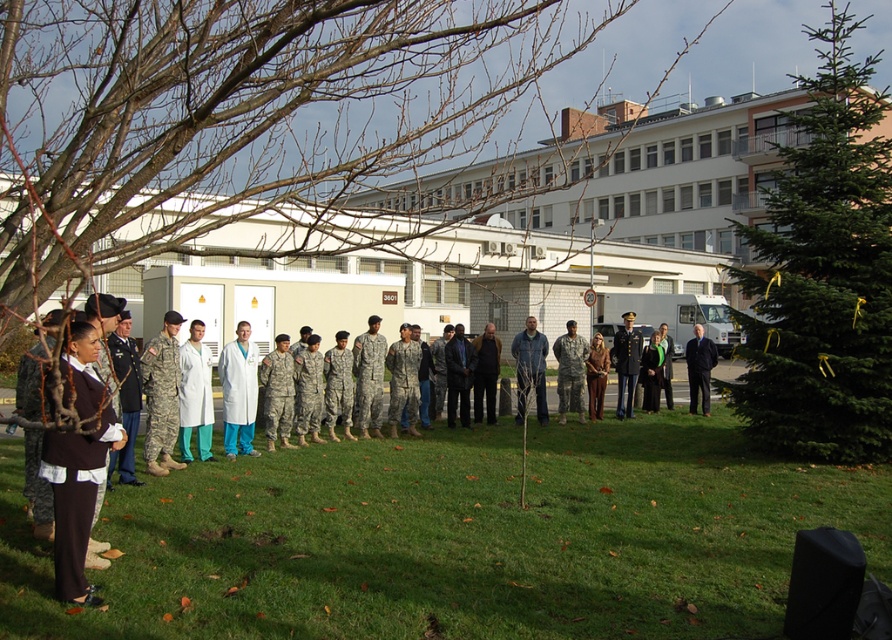
You are a photographer positioned at the white lab coat at center and want to capture a photo of the green textured evergreen tree at right. Given that your camera has a maximum zoom range of 10 meters, can you clearly capture the tree without moving closer?

The distance between the green textured evergreen tree at right and the white lab coat at center is 14.78 meters. Since the camera can only zoom up to 10 meters, you cannot clearly capture the tree without moving closer.

You are a photographer positioned at the back of the scene. You want to capture a photo of both the white matte coat at center and the white lab coat at center in the same frame without moving your camera. Can you fit both into the frame if your camera has a maximum field of view of 20 inches?

The distance between the white matte coat at center and the white lab coat at center is 20.90 inches. Since the camera has a maximum field of view of 20 inches, which is less than the required distance, you cannot fit both into the frame without moving the camera.

You are a photographer trying to capture a group photo of the green grass at center and dark blue fabric suit at center. Which object will appear bigger in your photo?

The green grass at center will appear bigger in the photo because it is larger in size than the dark blue fabric suit at center.